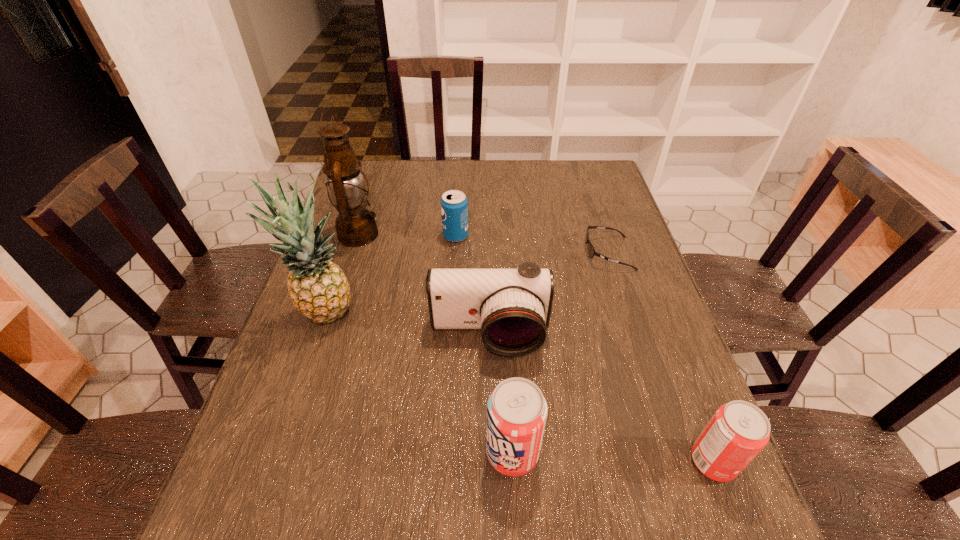
Where is `object that is at the near right corner`? The image size is (960, 540). object that is at the near right corner is located at coordinates (738, 431).

Identify the location of vacant region at the far edge of the desktop. The width and height of the screenshot is (960, 540). (487, 181).

The height and width of the screenshot is (540, 960). I want to click on free region at the near edge, so click(349, 470).

Where is `vacant space at the left edge of the desktop`? vacant space at the left edge of the desktop is located at coordinates (369, 254).

Find the location of a particular element. vacant space at the right edge of the desktop is located at coordinates (623, 232).

Where is `free space at the far right corner of the desktop`? The image size is (960, 540). free space at the far right corner of the desktop is located at coordinates (578, 193).

In the image, there is a desktop. Find the location of `vacant space at the near right corner`. vacant space at the near right corner is located at coordinates (655, 482).

In order to click on free point between the rightmost soda can and the shortest object in this screenshot , I will do `click(660, 358)`.

At what (x,y) coordinates should I click in order to perform the action: click on empty space that is in between the farthest soda can and the second soda can from right to left. Please return your answer as a coordinate pair (x, y). This screenshot has height=540, width=960. Looking at the image, I should click on (484, 345).

The width and height of the screenshot is (960, 540). In order to click on free space between the camcorder and the rightmost soda can in this screenshot , I will do `click(601, 399)`.